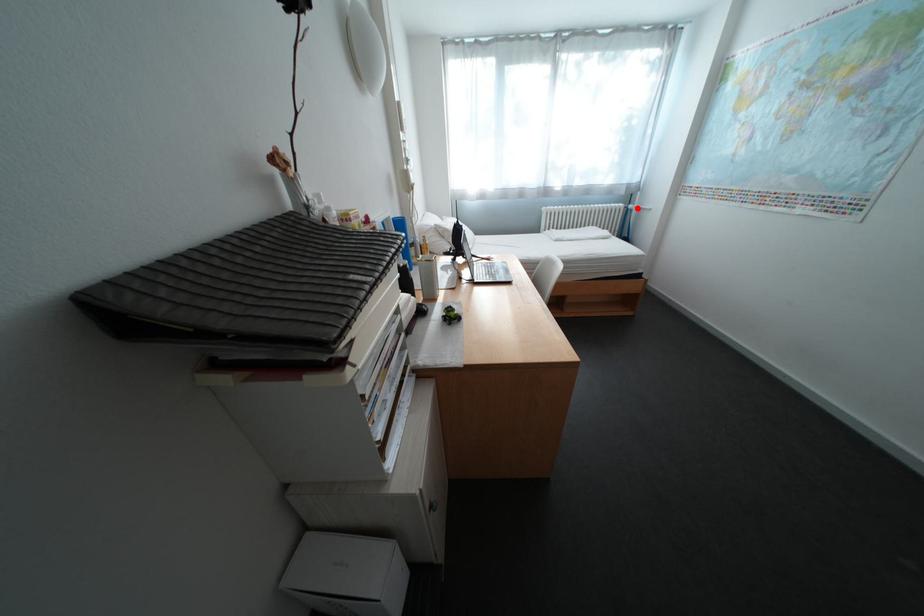
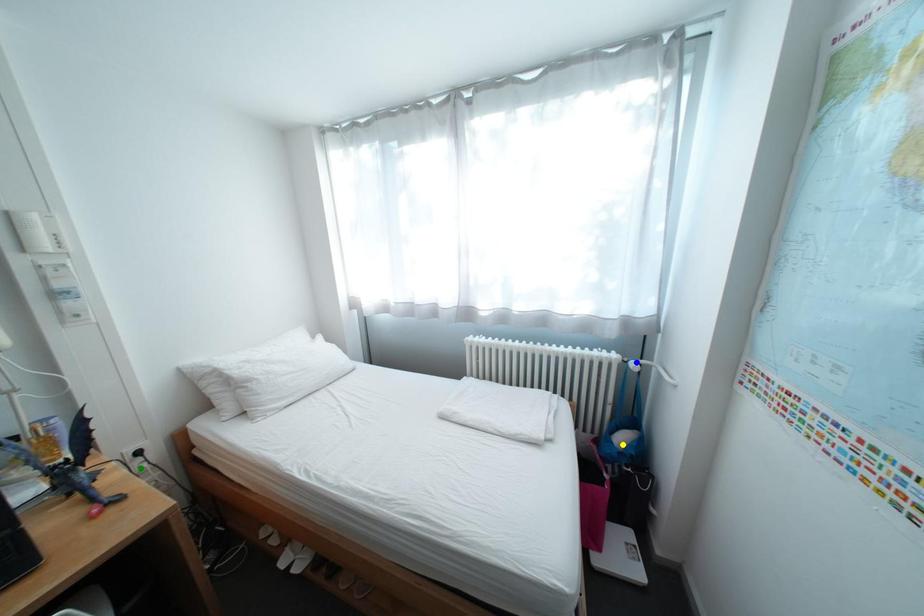
Question: I am providing you with two images of the same scene from different viewpoints. A red point is marked on the first image. You are given multiple points on the second image. Which point in image 2 represents the same 3d spot as the red point in image 1?

Choices:
 (A) yellow point
 (B) blue point
 (C) green point

Answer: (B)